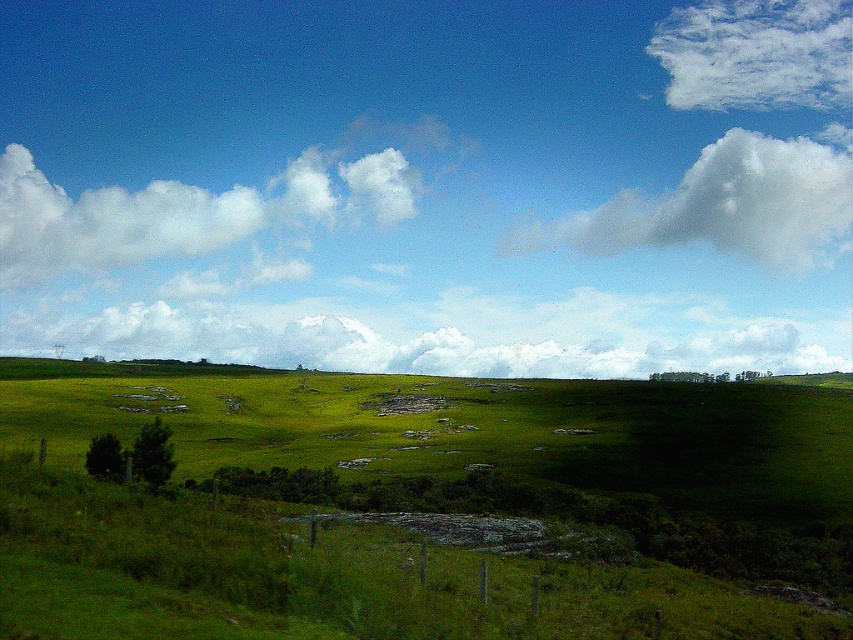
You are an airplane pilot flying over the rural landscape. You notice two white fluffy clouds in the sky. Which one, the white fluffy cloud at center or the white fluffy cloud at upper right, is lower in the sky?

The white fluffy cloud at center is lower in the sky because it is shorter than the white fluffy cloud at upper right.

You are standing in the middle of the field and looking up at the sky. Which cloud, the white fluffy cloud at upper center or the white fluffy cloud at upper right, appears nearer to you?

The white fluffy cloud at upper center appears nearer to you because it is closer to the viewer than the white fluffy cloud at upper right.

Looking at this image, you are a hot air balloon pilot preparing to land in the field. You notice two white fluffy clouds in the sky. The white fluffy cloud at upper center and the white fluffy cloud at upper left. How far apart are these two clouds?

The white fluffy cloud at upper center is 103.36 meters away from the white fluffy cloud at upper left.